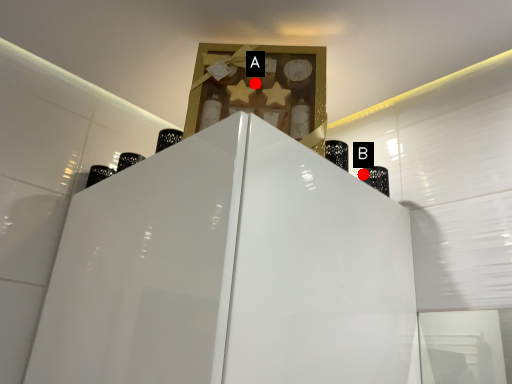
Question: Two points are circled on the image, labeled by A and B beside each circle. Which point appears farthest from the camera in this image?

Choices:
 (A) A is further
 (B) B is further

Answer: (B)